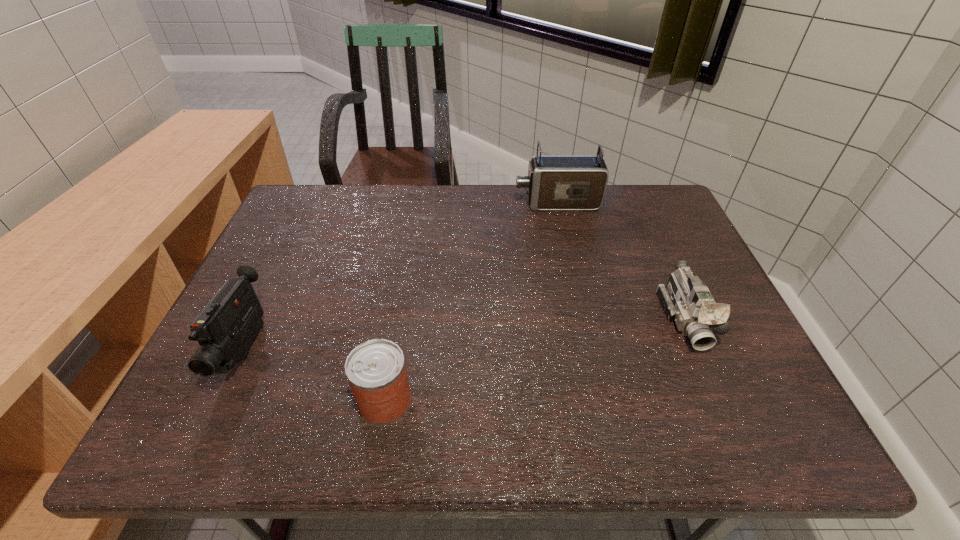
At what (x,y) coordinates should I click in order to perform the action: click on free spot between the third object from left to right and the shortest camcorder. Please return your answer as a coordinate pair (x, y). This screenshot has width=960, height=540. Looking at the image, I should click on (621, 261).

Identify the location of free space between the rightmost object and the farthest camcorder. The height and width of the screenshot is (540, 960). (621, 261).

The image size is (960, 540). Find the location of `free space between the rightmost camcorder and the leftmost camcorder`. free space between the rightmost camcorder and the leftmost camcorder is located at coordinates (465, 334).

You are a GUI agent. You are given a task and a screenshot of the screen. Output one action in this format:
    pyautogui.click(x=<x>, y=<y>)
    Task: Click on the vacant space that's between the shortest camcorder and the tallest camcorder
    Image resolution: width=960 pixels, height=540 pixels.
    Given the screenshot: What is the action you would take?
    pyautogui.click(x=621, y=261)

Point out which object is positioned as the third nearest to the second object from left to right. Please provide its 2D coordinates. Your answer should be formatted as a tuple, i.e. [(x, y)], where the tuple contains the x and y coordinates of a point satisfying the conditions above.

[(554, 182)]

Identify which object is the second closest to the shortest camcorder. Please provide its 2D coordinates. Your answer should be formatted as a tuple, i.e. [(x, y)], where the tuple contains the x and y coordinates of a point satisfying the conditions above.

[(376, 371)]

The height and width of the screenshot is (540, 960). Find the location of `camcorder that is the second nearest to the tallest object`. camcorder that is the second nearest to the tallest object is located at coordinates (226, 327).

At what (x,y) coordinates should I click in order to perform the action: click on the closest camcorder relative to the rightmost object. Please return your answer as a coordinate pair (x, y). The width and height of the screenshot is (960, 540). Looking at the image, I should click on (554, 182).

Find the location of a particular element. free space that satisfies the following two spatial constraints: 1. on the front-facing side of the can; 2. on the left side of the third shortest object is located at coordinates (220, 401).

The image size is (960, 540). Identify the location of free space that satisfies the following two spatial constraints: 1. on the front-facing side of the can; 2. on the right side of the leftmost object. (220, 401).